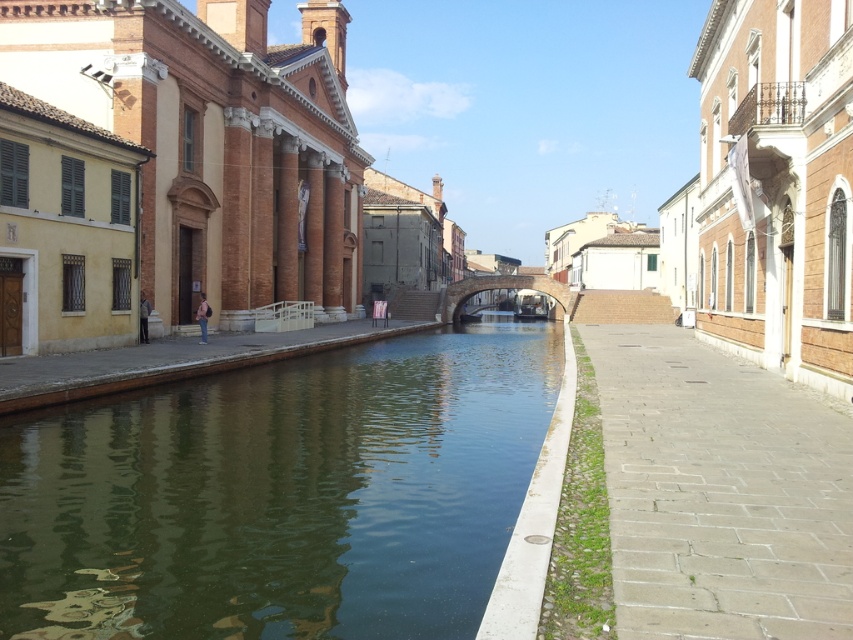
Question: Which of these objects is positioned closest to the greenish water at center?

Choices:
 (A) brick stone bridge at center
 (B) green concrete sidewalk at lower right

Answer: (B)

Question: Based on their relative distances, which object is nearer to the greenish water at center?

Choices:
 (A) green concrete sidewalk at lower right
 (B) brick stone bridge at center

Answer: (A)

Question: Is green concrete sidewalk at lower right smaller than brick stone bridge at center?

Choices:
 (A) no
 (B) yes

Answer: (B)

Question: Observing the image, what is the correct spatial positioning of green concrete sidewalk at lower right in reference to brick stone bridge at center?

Choices:
 (A) above
 (B) below

Answer: (B)

Question: Can you confirm if green concrete sidewalk at lower right is bigger than brick stone bridge at center?

Choices:
 (A) no
 (B) yes

Answer: (A)

Question: Estimate the real-world distances between objects in this image. Which object is closer to the brick stone bridge at center?

Choices:
 (A) greenish water at center
 (B) green concrete sidewalk at lower right

Answer: (A)